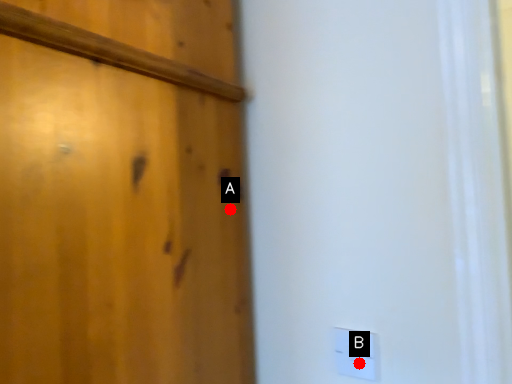
Question: Two points are circled on the image, labeled by A and B beside each circle. Which of the following is the closest to the observer?

Choices:
 (A) A is closer
 (B) B is closer

Answer: (B)